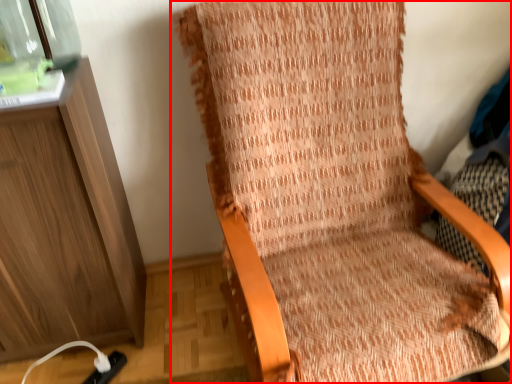
Question: Observing the image, what is the correct spatial positioning of chair (annotated by the red box) in reference to glass jar?

Choices:
 (A) left
 (B) right

Answer: (B)